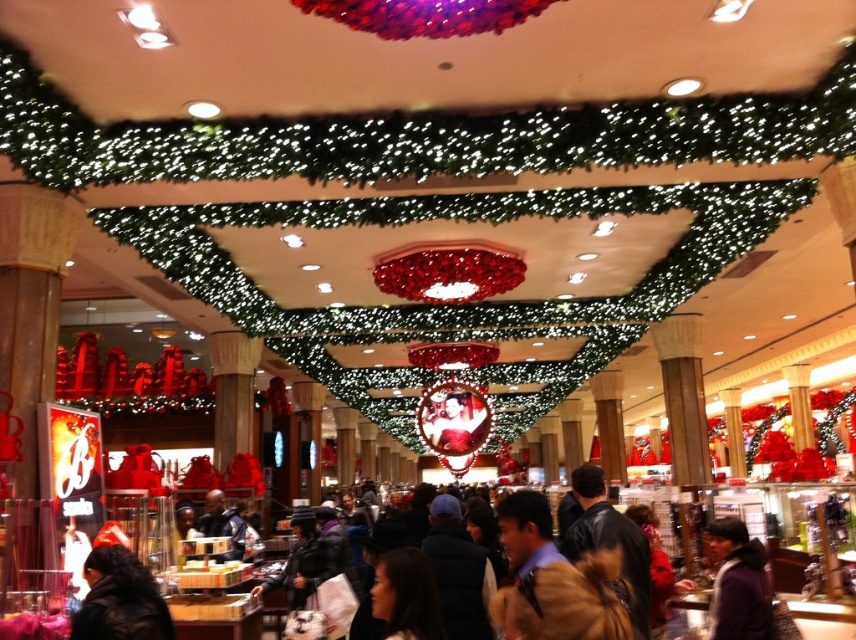
Question: Can you confirm if brown leather jacket at lower right is thinner than dark blue leather jacket at center?

Choices:
 (A) yes
 (B) no

Answer: (A)

Question: Does purple fuzzy jacket at lower right come in front of brown leather jacket at lower right?

Choices:
 (A) yes
 (B) no

Answer: (B)

Question: Which point is farther from the camera taking this photo?

Choices:
 (A) (765, 557)
 (B) (598, 474)
 (C) (100, 572)
 (D) (217, 493)

Answer: (D)

Question: Which of these objects is positioned farthest from the dark blue leather jacket at center?

Choices:
 (A) purple fuzzy jacket at lower right
 (B) brown leather jacket at lower right

Answer: (B)

Question: Which point is closer to the camera?

Choices:
 (A) brown leather jacket at lower right
 (B) purple fuzzy jacket at lower right

Answer: (A)

Question: In this image, where is black leather jacket at lower left located relative to dark blue leather jacket at center?

Choices:
 (A) above
 (B) below

Answer: (A)